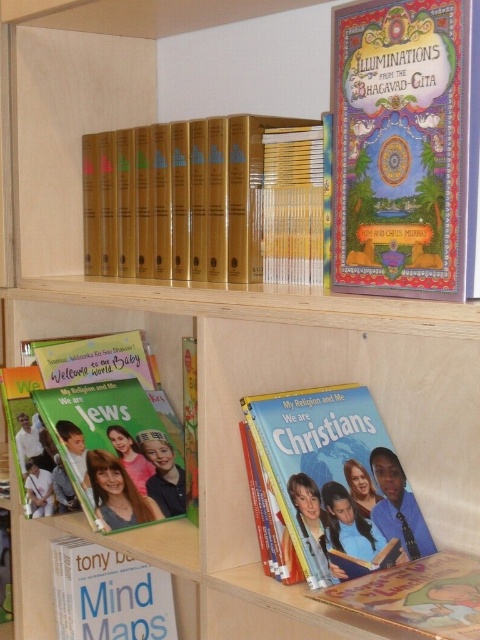
Does multicolored illustrated book at upper right appear over matte paper book at center?

Indeed, multicolored illustrated book at upper right is positioned over matte paper book at center.

Which is more to the right, multicolored illustrated book at upper right or matte paper book at center?

multicolored illustrated book at upper right is more to the right.

The width and height of the screenshot is (480, 640). What do you see at coordinates (400, 147) in the screenshot?
I see `multicolored illustrated book at upper right` at bounding box center [400, 147].

This screenshot has height=640, width=480. Find the location of `multicolored illustrated book at upper right`. multicolored illustrated book at upper right is located at coordinates [400, 147].

Between point (430, 13) and point (110, 481), which one is positioned behind?

The point (110, 481) is behind.

Is point (344, 236) closer to viewer compared to point (68, 419)?

Yes, it is.

Locate an element on the screen. The width and height of the screenshot is (480, 640). multicolored illustrated book at upper right is located at coordinates (400, 147).

Does hardcover book at lower right appear on the right side of hardcover book at lower left?

Correct, you'll find hardcover book at lower right to the right of hardcover book at lower left.

Can you confirm if hardcover book at lower right is positioned to the left of hardcover book at lower left?

Incorrect, hardcover book at lower right is not on the left side of hardcover book at lower left.

The height and width of the screenshot is (640, 480). Describe the element at coordinates (417, 595) in the screenshot. I see `hardcover book at lower right` at that location.

This screenshot has height=640, width=480. Identify the location of hardcover book at lower right. (417, 595).